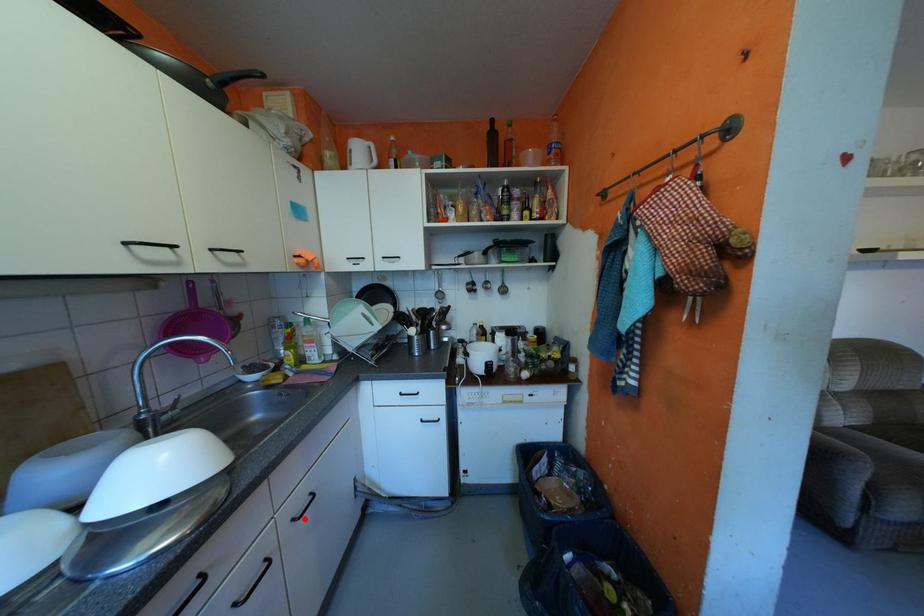
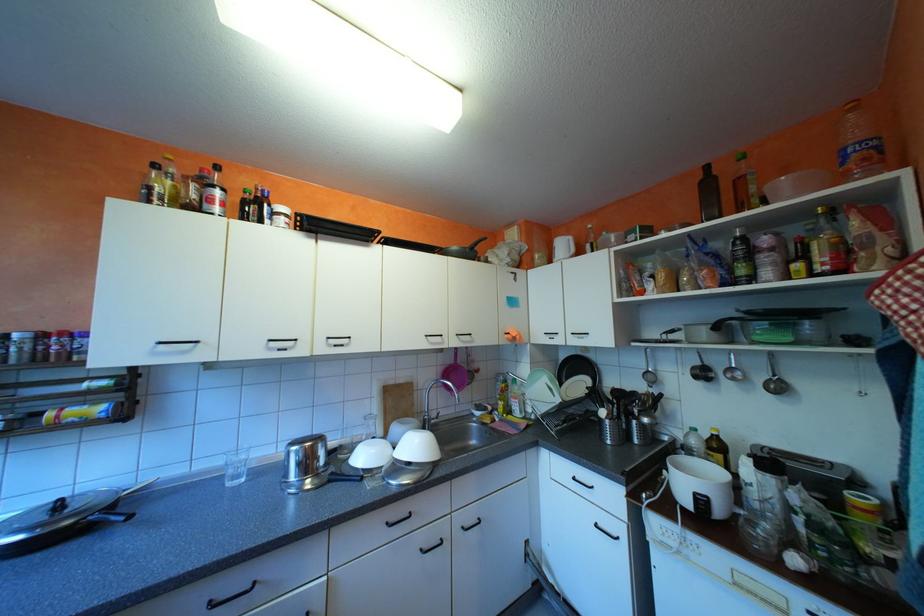
Question: A red point is marked in image1. In image2, is the corresponding 3D point closer to the camera or farther? Reply with the corresponding letter.

Choices:
 (A) The corresponding 3D point is closer.
 (B) The corresponding 3D point is farther.

Answer: (B)